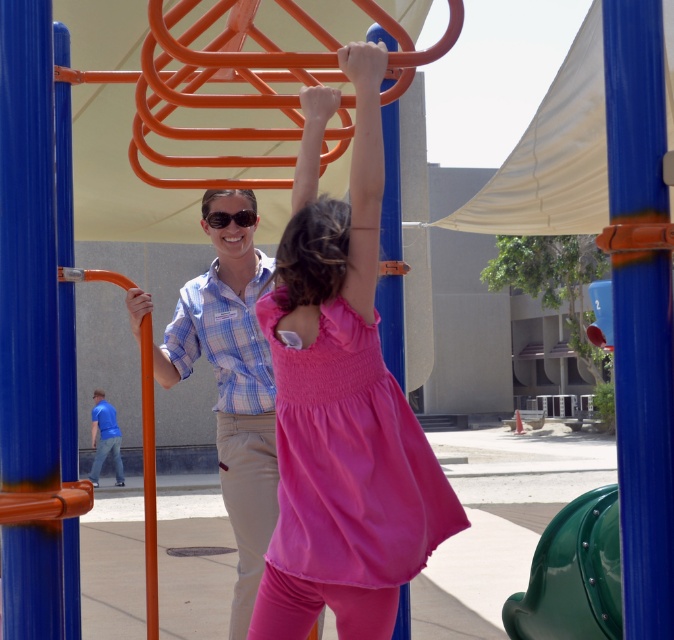
Question: Is pink fabric dress at center below blue plastic pole at center?

Choices:
 (A) yes
 (B) no

Answer: (A)

Question: Which of the following is the farthest from the observer?

Choices:
 (A) (208, 212)
 (B) (643, 436)
 (C) (222, 339)
 (D) (396, 376)

Answer: (D)

Question: Observing the image, what is the correct spatial positioning of pink fabric dress at center in reference to blue plastic pole at center?

Choices:
 (A) right
 (B) left

Answer: (B)

Question: Does pink fabric dress at center appear over blue plaid shirt at center?

Choices:
 (A) no
 (B) yes

Answer: (B)

Question: Among these objects, which one is farthest from the camera?

Choices:
 (A) blue plastic pole at center
 (B) blue plaid shirt at center
 (C) orange matte pole at upper center
 (D) matte black sunglasses at center

Answer: (D)

Question: Which of the following is the farthest from the observer?

Choices:
 (A) blue plaid shirt at center
 (B) orange matte pole at upper center
 (C) pink fabric dress at center
 (D) matte black sunglasses at center

Answer: (D)